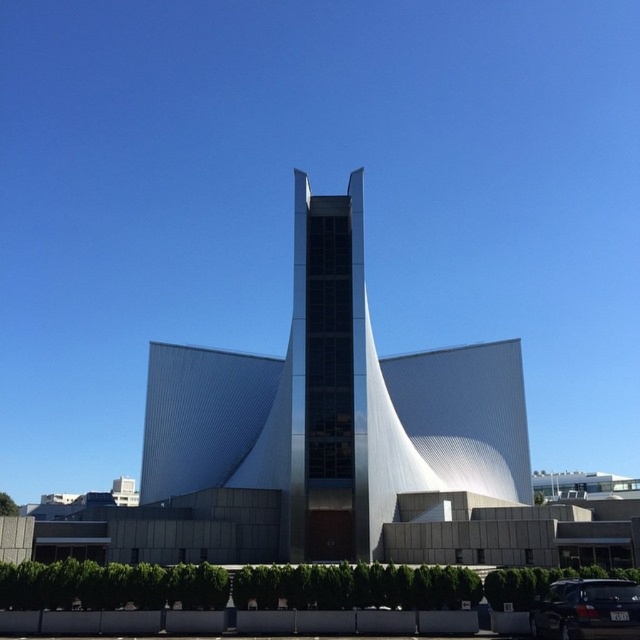
Question: Is metallic silver tower at center positioned at the back of dark gray metallic car at lower right?

Choices:
 (A) no
 (B) yes

Answer: (B)

Question: Which point is closer to the camera?

Choices:
 (A) smooth glass tower at center
 (B) metallic silver tower at center
 (C) dark gray metallic car at lower right

Answer: (C)

Question: Does smooth glass tower at center have a larger size compared to dark gray metallic car at lower right?

Choices:
 (A) yes
 (B) no

Answer: (A)

Question: Which point is closer to the camera?

Choices:
 (A) (296, 412)
 (B) (339, 308)

Answer: (A)

Question: Is metallic silver tower at center to the right of dark gray metallic car at lower right from the viewer's perspective?

Choices:
 (A) no
 (B) yes

Answer: (A)

Question: Which of the following is the farthest from the observer?

Choices:
 (A) (348, 272)
 (B) (273, 385)

Answer: (B)